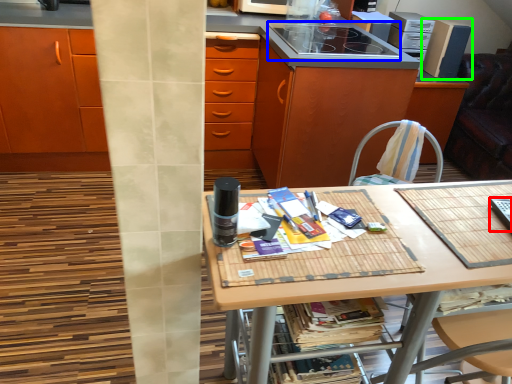
Question: Which is nearer to the appliance (highlighted by a red box)? appliance (highlighted by a blue box) or kitchen appliance (highlighted by a green box).

Choices:
 (A) appliance
 (B) kitchen appliance

Answer: (A)